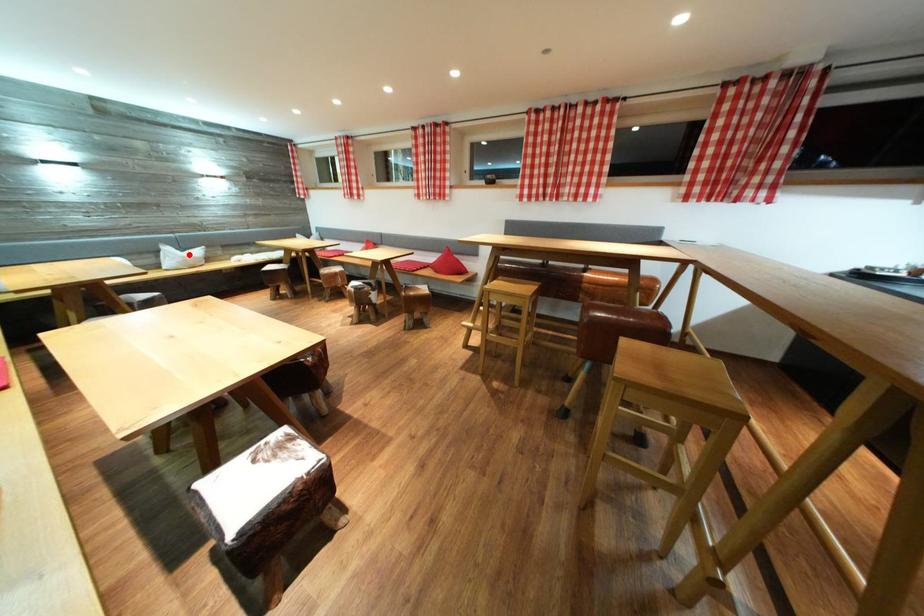
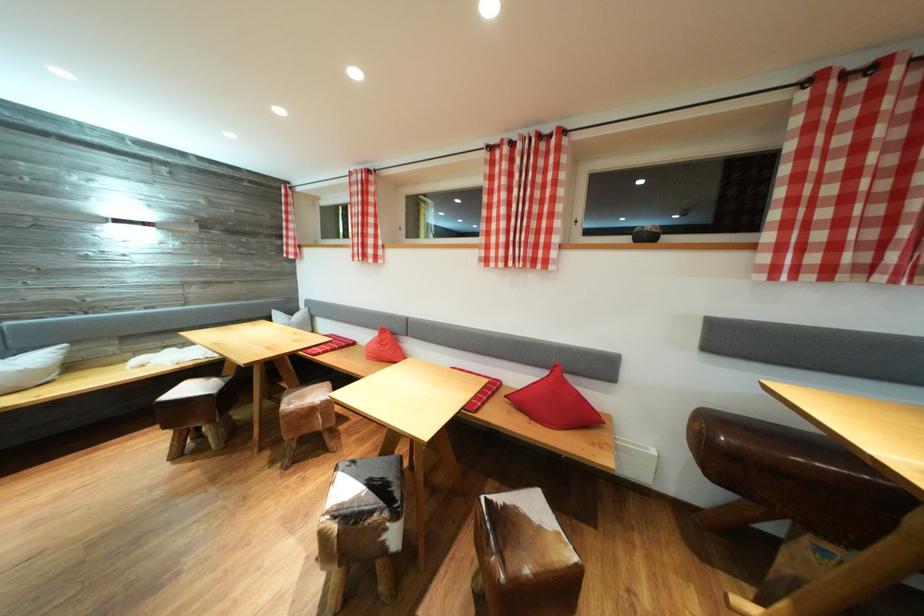
The point at the highlighted location is marked in the first image. Where is the corresponding point in the second image?

(14, 358)